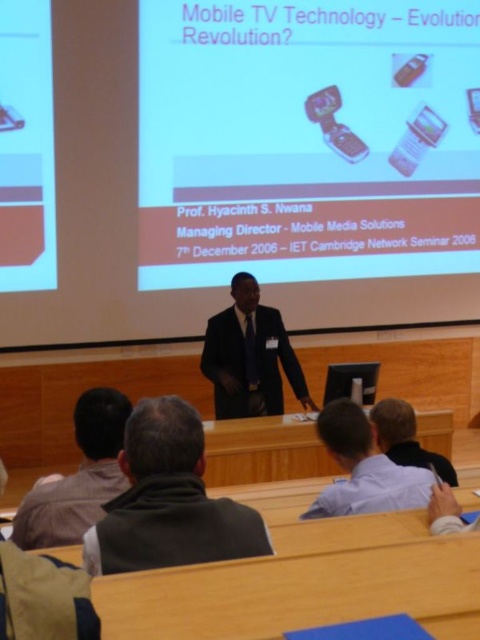
Question: Which of the following is the closest to the observer?

Choices:
 (A) white glossy projector screen at upper center
 (B) striped shirt at lower left
 (C) gray fleece vest at lower center
 (D) light blue shirt at center

Answer: (C)

Question: Which of the following is the farthest from the observer?

Choices:
 (A) dark suit at center
 (B) white glossy projector screen at upper center
 (C) matte black screen at left
 (D) striped shirt at lower left

Answer: (B)

Question: Where is striped shirt at lower left located in relation to light blue shirt at center in the image?

Choices:
 (A) left
 (B) right

Answer: (A)

Question: Which point is closer to the camera taking this photo?

Choices:
 (A) [x=57, y=573]
 (B) [x=349, y=504]

Answer: (A)

Question: Is white glossy projector screen at upper center positioned at the back of striped shirt at lower left?

Choices:
 (A) yes
 (B) no

Answer: (A)

Question: Is white glossy projector screen at upper center closer to camera compared to dark suit at center?

Choices:
 (A) yes
 (B) no

Answer: (B)